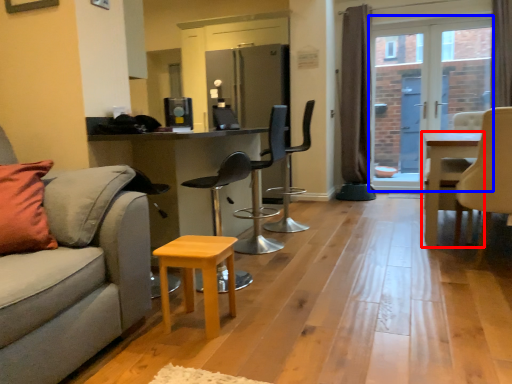
Question: Which object is closer to the camera taking this photo, table (highlighted by a red box) or window screen (highlighted by a blue box)?

Choices:
 (A) table
 (B) window screen

Answer: (A)